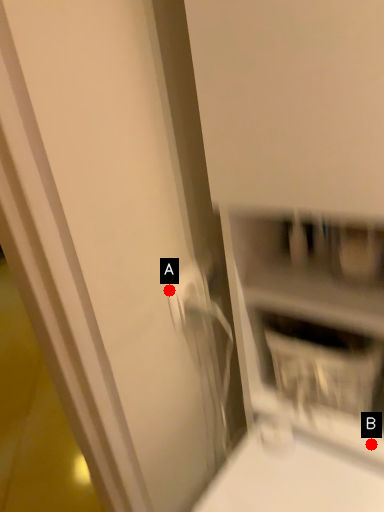
Question: Two points are circled on the image, labeled by A and B beside each circle. Which point is farther from the camera taking this photo?

Choices:
 (A) A is further
 (B) B is further

Answer: (B)